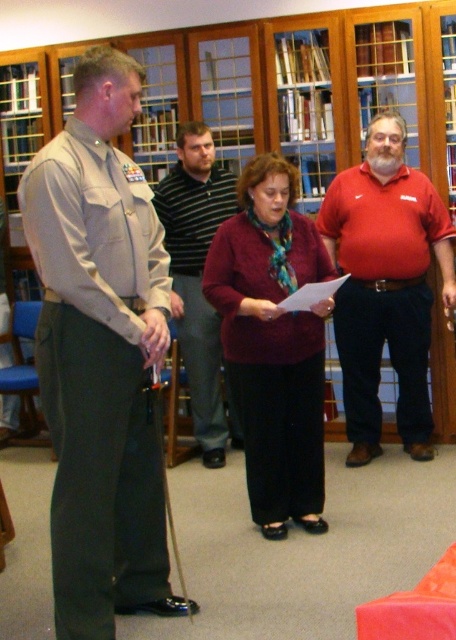
Image resolution: width=456 pixels, height=640 pixels. I want to click on maroon sweater at center, so click(x=274, y=342).

Is point (227, 333) positioned after point (232, 214)?

No, (227, 333) is in front of (232, 214).

Find the location of a particular element. This screenshot has width=456, height=640. maroon sweater at center is located at coordinates (274, 342).

Which is more to the right, khaki uniform at left or maroon sweater at center?

Positioned to the right is maroon sweater at center.

Can you confirm if khaki uniform at left is positioned to the right of maroon sweater at center?

Incorrect, khaki uniform at left is not on the right side of maroon sweater at center.

Which is behind, point (52, 170) or point (267, 348)?

The point (267, 348) is behind.

Locate an element on the screen. This screenshot has width=456, height=640. khaki uniform at left is located at coordinates (100, 355).

From the picture: Does khaki uniform at left appear on the right side of striped cotton shirt at center?

No, khaki uniform at left is not to the right of striped cotton shirt at center.

Is khaki uniform at left positioned at the back of striped cotton shirt at center?

No, it is in front of striped cotton shirt at center.

Is point (66, 502) farther from viewer compared to point (203, 125)?

No, (66, 502) is closer to viewer.

Where is `khaki uniform at left`? khaki uniform at left is located at coordinates click(x=100, y=355).